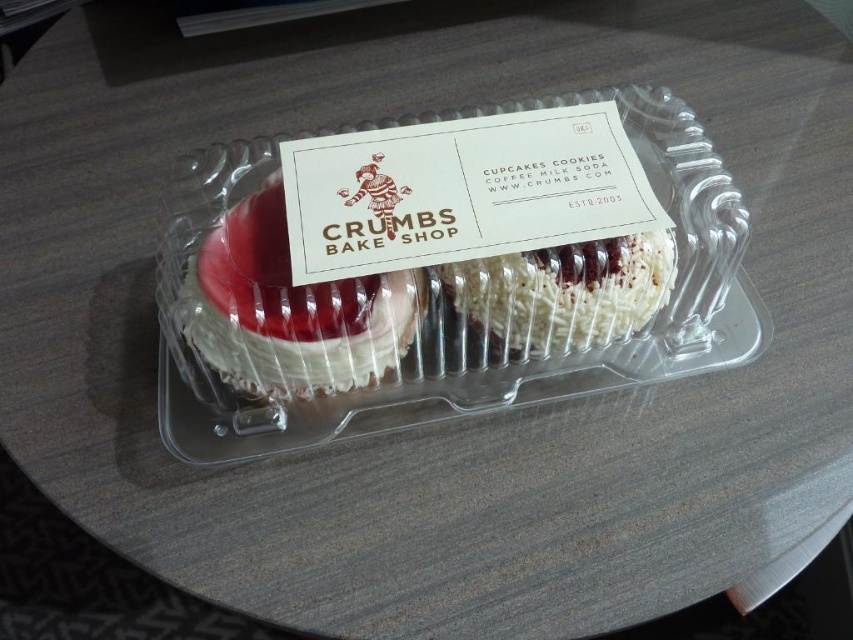
Question: Which point is closer to the camera taking this photo?

Choices:
 (A) (613, 294)
 (B) (554, 284)

Answer: (B)

Question: Which object is the closest to the white coconut-coated pastry at center?

Choices:
 (A) matte white cake at center
 (B) clear plastic tray at center

Answer: (B)

Question: Is clear plastic tray at center below matte white cake at center?

Choices:
 (A) no
 (B) yes

Answer: (A)

Question: Does clear plastic tray at center appear over white coconut-coated pastry at center?

Choices:
 (A) yes
 (B) no

Answer: (A)

Question: Which of these objects is positioned farthest from the white coconut-coated pastry at center?

Choices:
 (A) matte white cake at center
 (B) clear plastic tray at center

Answer: (A)

Question: Does matte white cake at center have a smaller size compared to white coconut-coated pastry at center?

Choices:
 (A) no
 (B) yes

Answer: (A)